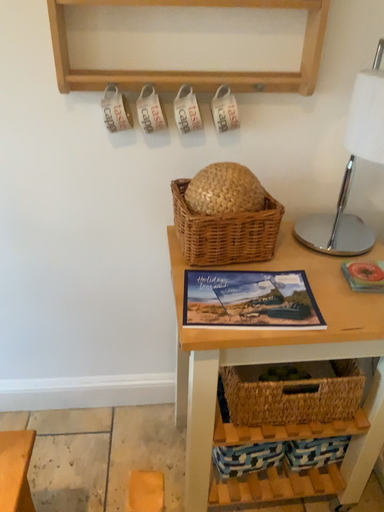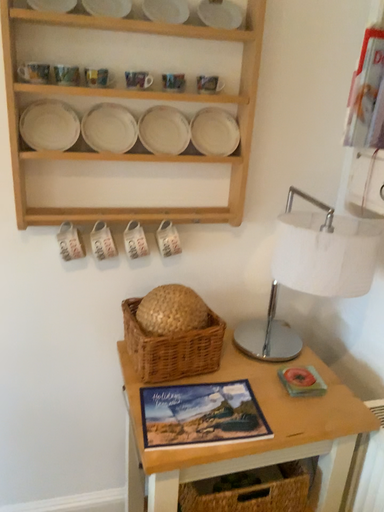
Question: How did the camera likely rotate when shooting the video?

Choices:
 (A) rotated right
 (B) rotated left

Answer: (A)